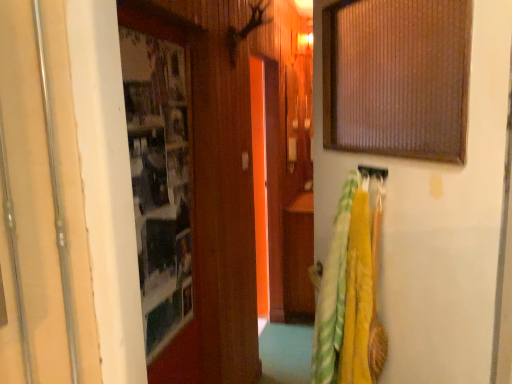
Question: Is point (262, 59) closer or farther from the camera than point (355, 357)?

Choices:
 (A) farther
 (B) closer

Answer: (A)

Question: Based on their positions, is transparent glass door at center located to the left or right of yellow fabric towel at right?

Choices:
 (A) right
 (B) left

Answer: (B)

Question: Estimate the real-world distances between objects in this image. Which object is farther from the yellow fabric towel at right?

Choices:
 (A) transparent glass door at center
 (B) metallic silver door at left

Answer: (A)

Question: Based on their relative distances, which object is farther from the yellow fabric towel at right?

Choices:
 (A) transparent glass door at center
 (B) metallic silver door at left

Answer: (A)